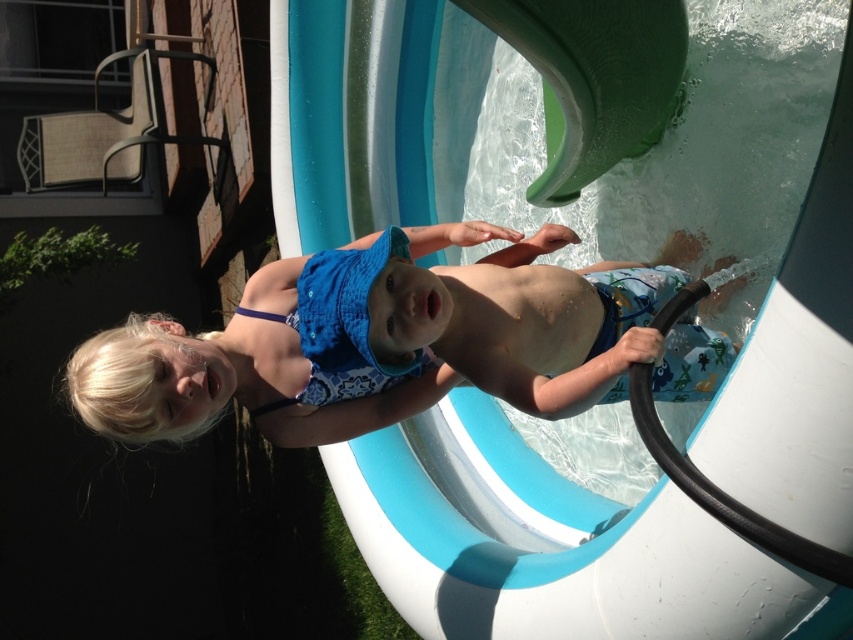
Question: Which point appears closest to the camera in this image?

Choices:
 (A) (782, 278)
 (B) (260, 355)

Answer: (A)

Question: In this image, where is blue fabric swimsuit at center located relative to blue printed fabric bikini top at center?

Choices:
 (A) above
 (B) below

Answer: (B)

Question: Which point appears closest to the camera in this image?

Choices:
 (A) click(x=374, y=362)
 (B) click(x=409, y=188)
 (C) click(x=676, y=355)

Answer: (A)

Question: Is green rubber slide at upper center above blue printed fabric bikini top at center?

Choices:
 (A) no
 (B) yes

Answer: (A)

Question: Where is green rubber slide at upper center located in relation to blue printed fabric bikini top at center in the image?

Choices:
 (A) right
 (B) left

Answer: (A)

Question: Estimate the real-world distances between objects in this image. Which object is farther from the blue fabric swimsuit at center?

Choices:
 (A) green rubber slide at upper center
 (B) blue printed fabric bikini top at center

Answer: (A)